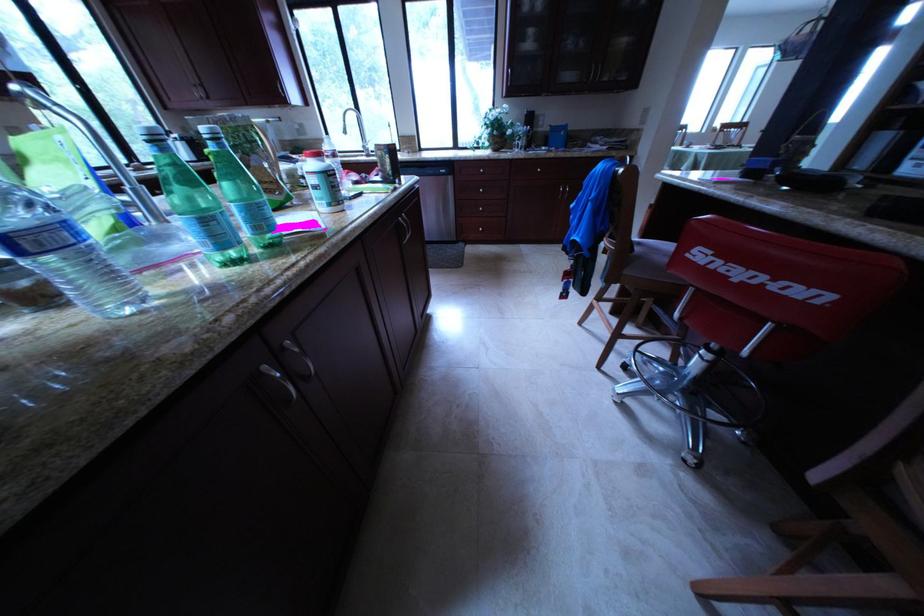
The location [322,182] corresponds to which object?

This point indicates the white supplement container.